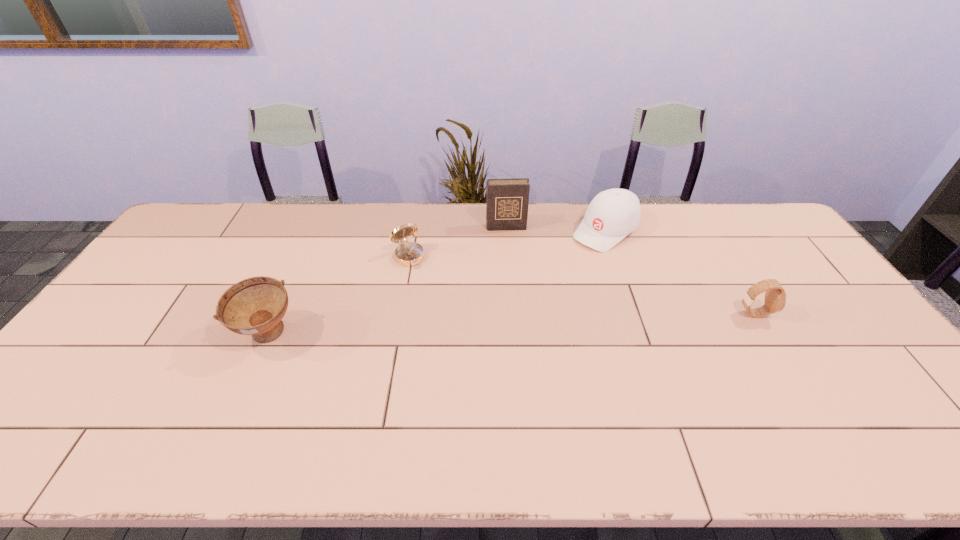
Identify the location of free point at the near edge. (488, 394).

The image size is (960, 540). I want to click on vacant space at the left edge of the desktop, so click(x=180, y=269).

In the image, there is a desktop. Where is `vacant space at the right edge`? vacant space at the right edge is located at coordinates (774, 276).

Find the location of `vacant region at the far left corner of the desktop`. vacant region at the far left corner of the desktop is located at coordinates (175, 242).

Where is `vacant space at the far right corner of the desktop`? This screenshot has width=960, height=540. vacant space at the far right corner of the desktop is located at coordinates (735, 206).

I want to click on free space between the rightmost object and the baseball cap, so click(679, 272).

This screenshot has width=960, height=540. Identify the location of unoccupied position between the tallest object and the rightmost object. coord(630,271).

Where is `vacant point located between the leftmost object and the baseball cap`? The image size is (960, 540). vacant point located between the leftmost object and the baseball cap is located at coordinates (437, 283).

Where is `vacant area that lies between the compass and the baseball cap`? vacant area that lies between the compass and the baseball cap is located at coordinates (507, 244).

Where is `empty space between the baseball cap and the diary`? empty space between the baseball cap and the diary is located at coordinates (556, 229).